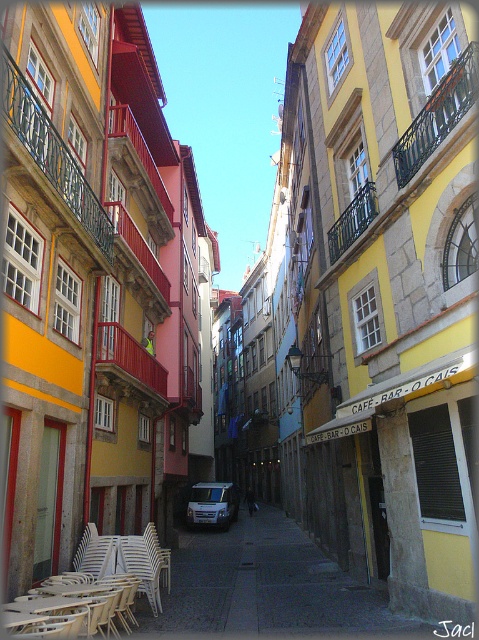
You are a tourist standing on the cobblestone street and want to take a photo of the white plastic chairs at lower left and the white matte van at center. Which object should you focus on first to ensure both are in the frame?

You should focus on the white plastic chairs at lower left first because they are closer to you than the white matte van at center, ensuring both are in the frame.

You are a delivery person trying to park your 2.5 meters tall delivery truck in this narrow street. You see the white plastic chairs at lower left and the white matte van at center. Which object is taller and would block your truck from entering?

The white matte van at center is taller than the white plastic chairs at lower left. Since your delivery truck is 2.5 meters tall, you need to check the height clearance of the street. If the van is taller than the chairs, it might indicate that the truck could pass if the van isn

You are a delivery person trying to park your 3m long delivery truck in this narrow street. The white matte van at center is parked in the middle of the street. There are white plastic chairs at lower left near the curb. Considering the space between the chairs and the van, can your truck fit through without hitting either?

The white plastic chairs at lower left are smaller than the white matte van at center, but the description does not provide specific measurements of the distance between them. Without knowing the exact space available, it is impossible to determine if the 3m long delivery truck can fit through safely.